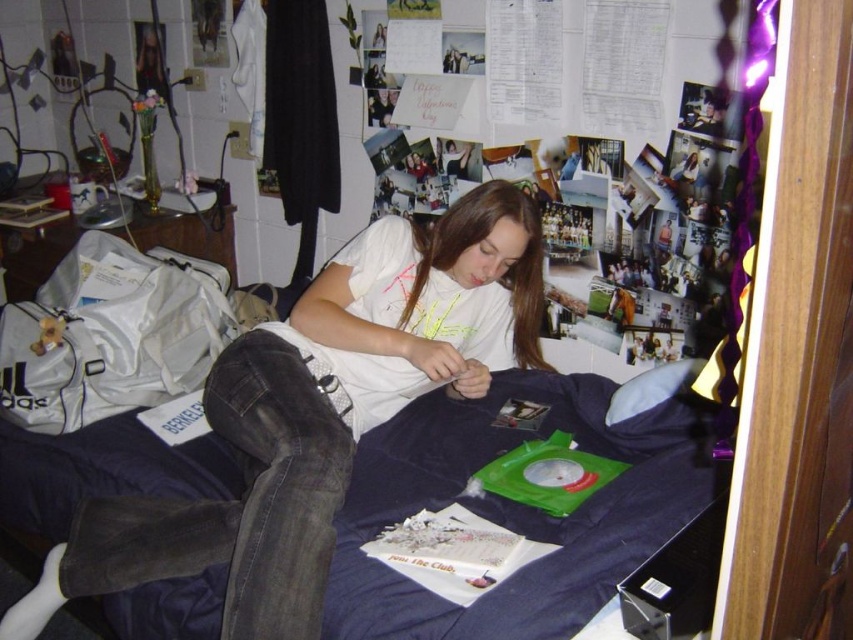
From the picture: Who is lower down, white matte t-shirt at center or navy blue fabric at center?

navy blue fabric at center is below.

Can you confirm if white matte t-shirt at center is positioned above navy blue fabric at center?

Yes.

Who is more distant from viewer, (18, 627) or (469, 458)?

Positioned behind is point (469, 458).

Locate an element on the screen. white matte t-shirt at center is located at coordinates (318, 413).